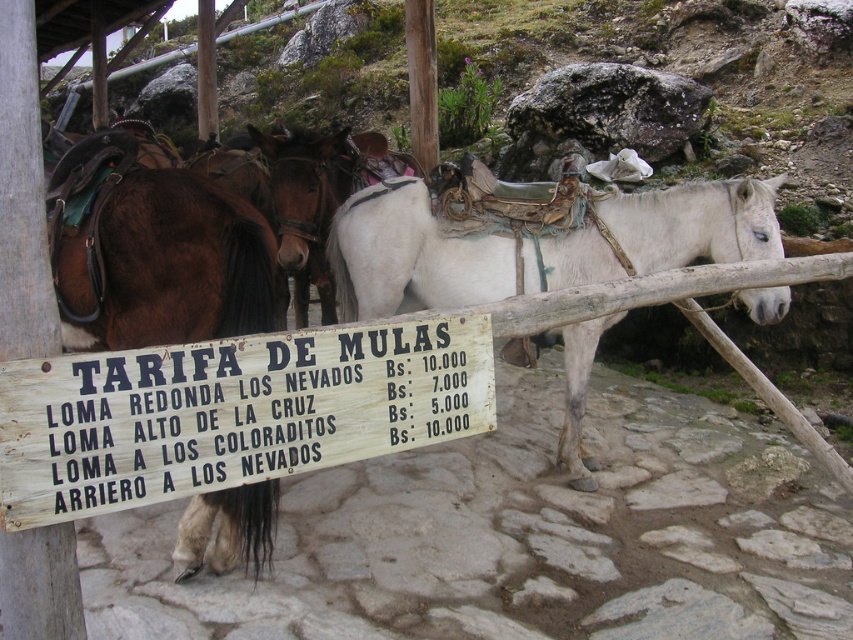
You are a tourist at the mule station and want to choose between the two routes listed on the signboard. The first route is marked at point (88, 324) and the second at point (572, 372). The signboard is placed between you and the mules. Which route option is closer to you?

Point (88, 324) is in front of point (572, 372), so the route marked at point (88, 324) is closer to you.

You are a tourist standing in front of the black wood sign at center and the white leather horse at center. Which object is nearer to you?

The black wood sign at center is closer to the viewer than the white leather horse at center, so the black wood sign at center is nearer to you.

You are a tourist planning to ride a mule and want to choose the one that is closer to you. Which mule should you pick between the brown glossy horse at left and the white leather horse at center?

The brown glossy horse at left is closer to the viewer than the white leather horse at center, so you should pick the brown glossy horse at left.